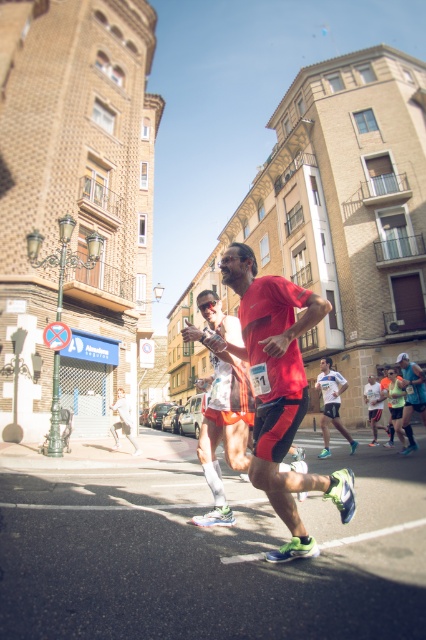
You are a photographer standing at the starting line of the marathon, and you want to take a photo of the point at coordinates point (210,408). If your camera has a focal length of 50mm and you are 16.45 feet away from the point, what is the angle of view required to capture the entire scene including the point?

The point (210,408) is 16.45 feet from the viewer. To calculate the angle of view, use the formula angle of view in degrees equals 57.3 multiplied by the object distance divided by the focal length. Plugging in the values, angle of view equals 57.3 multiplied by 16.45 divided by 50, which equals approximately 19.1 degrees. Therefore, the required angle of view is approximately 19.1 degrees.

In the scene shown: You are a photographer trying to capture a runner in motion. You see the white matte running shirt at center and the matte red shorts at center. How far apart are these two items on the runner?

The white matte running shirt at center and the matte red shorts at center are 7.07 feet apart from each other.

You are a photographer capturing the runner in the center. The white matte running shirt at center and the matte red shorts at center are both in focus. Which one appears wider in the photo?

The white matte running shirt at center might be wider than matte red shorts at center according to the description.